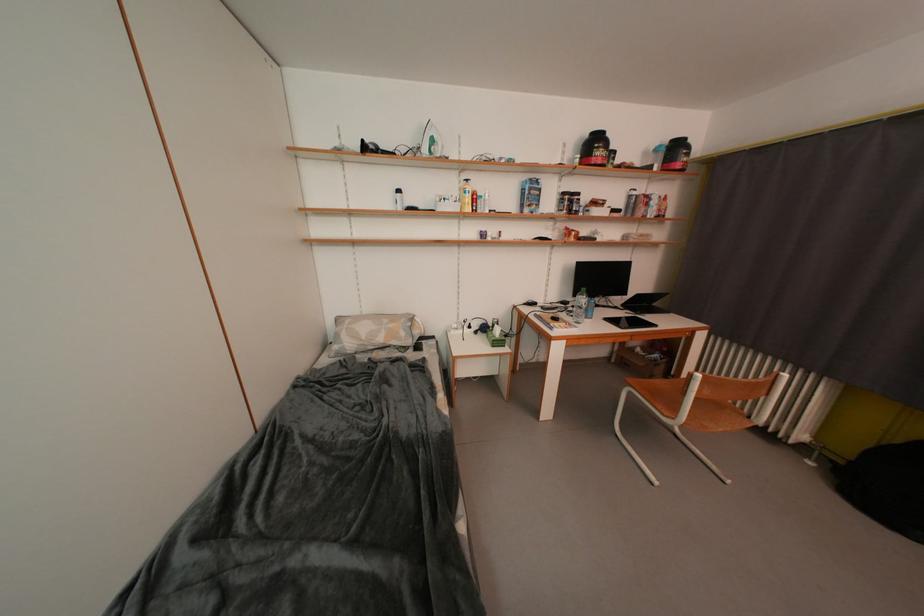
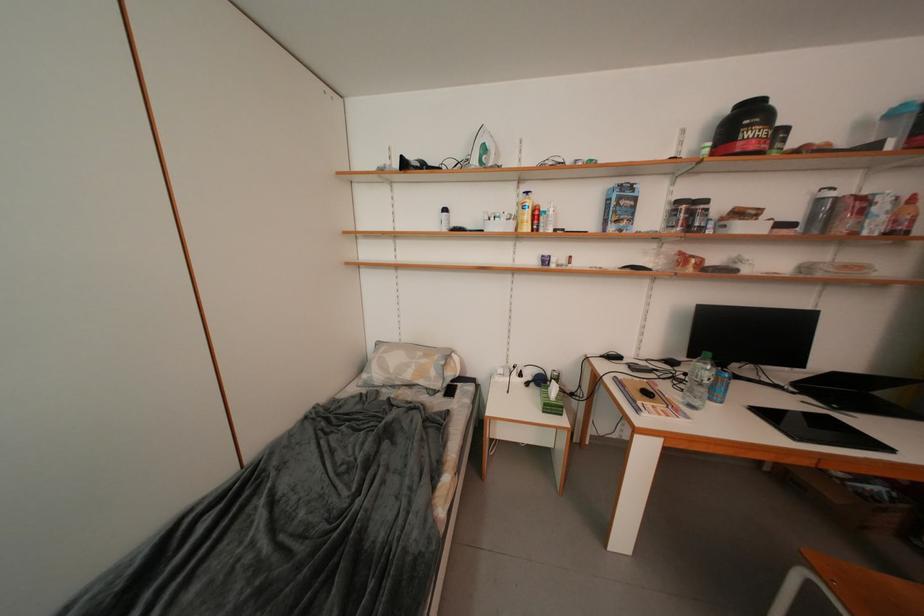
Question: The camera is either moving clockwise (left) or counter-clockwise (right) around the object. The first image is from the beginning of the video and the second image is from the end. Is the camera moving left or right when shooting the video?

Choices:
 (A) Left
 (B) Right

Answer: (B)